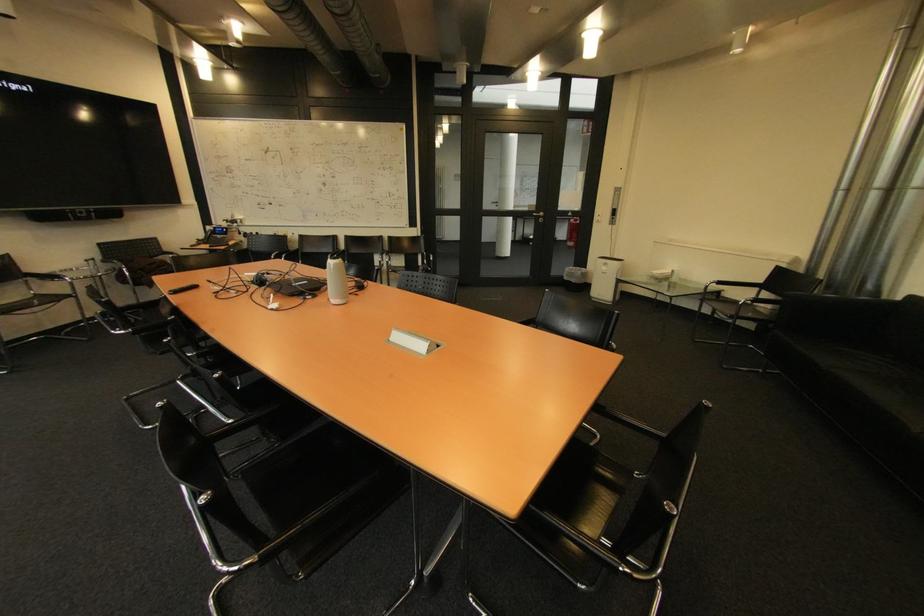
Find the location of a particular element. The width and height of the screenshot is (924, 616). black remote control is located at coordinates (183, 288).